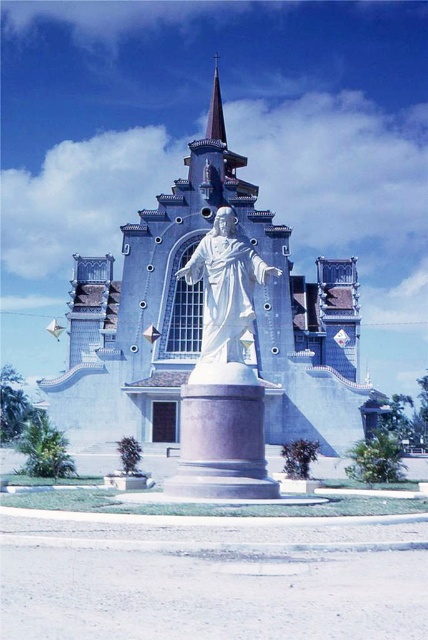
Question: Among these objects, which one is farthest from the camera?

Choices:
 (A) purple glass spire at upper center
 (B) white stone church at center
 (C) white polished stone pedestal at center

Answer: (A)

Question: Does white stone church at center appear over purple glass spire at upper center?

Choices:
 (A) no
 (B) yes

Answer: (A)

Question: Does white polished stone pedestal at center lie in front of purple glass spire at upper center?

Choices:
 (A) yes
 (B) no

Answer: (A)

Question: Does white stone church at center lie behind white marble statue at center?

Choices:
 (A) no
 (B) yes

Answer: (B)

Question: Which object appears closest to the camera in this image?

Choices:
 (A) white marble statue at center
 (B) white polished stone pedestal at center

Answer: (B)

Question: Considering the real-world distances, which object is closest to the purple glass spire at upper center?

Choices:
 (A) white marble statue at center
 (B) white stone church at center

Answer: (B)